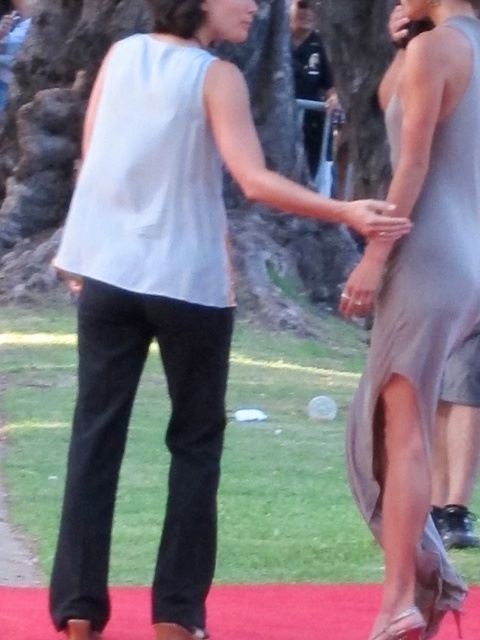
Question: Is satin gray dress at right smaller than satin silver dress at center?

Choices:
 (A) yes
 (B) no

Answer: (B)

Question: Which of the following is the closest to the observer?

Choices:
 (A) satin gray dress at right
 (B) dark blue uniform at upper center
 (C) satin silver dress at center

Answer: (C)

Question: Which object is farther from the camera taking this photo?

Choices:
 (A) satin gray dress at right
 (B) dark blue uniform at upper center
 (C) satin silver dress at center

Answer: (B)

Question: Which point is closer to the camera taking this photo?

Choices:
 (A) (439, 332)
 (B) (323, 99)
 (C) (384, 211)

Answer: (C)

Question: Can you confirm if satin gray dress at right is positioned to the left of satin silver dress at center?

Choices:
 (A) yes
 (B) no

Answer: (B)

Question: Is satin gray dress at right above satin silver dress at center?

Choices:
 (A) yes
 (B) no

Answer: (B)